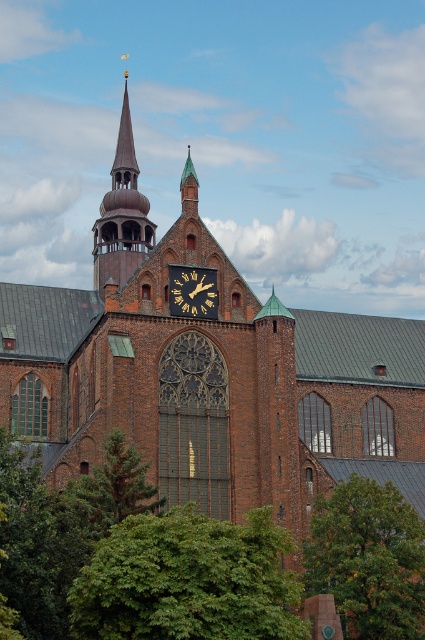
Does green leafy tree at lower left have a greater height compared to green needle-like tree at center-left?

Yes, green leafy tree at lower left is taller than green needle-like tree at center-left.

Is point (119, 625) positioned after point (116, 454)?

No, it is not.

Find the location of `green leafy tree at lower left`. green leafy tree at lower left is located at coordinates (189, 580).

Is brown wooden bell tower at upper center bigger than green needle-like tree at center-left?

Yes.

Is brown wooden bell tower at upper center thinner than green needle-like tree at center-left?

In fact, brown wooden bell tower at upper center might be wider than green needle-like tree at center-left.

I want to click on brown wooden bell tower at upper center, so click(x=121, y=214).

Can you confirm if green leafy tree at lower right is bigger than green needle-like tree at center-left?

Yes.

Can you confirm if green leafy tree at lower right is positioned above green needle-like tree at center-left?

Actually, green leafy tree at lower right is below green needle-like tree at center-left.

You are a GUI agent. You are given a task and a screenshot of the screen. Output one action in this format:
    pyautogui.click(x=<x>, y=<y>)
    Task: Click on the green leafy tree at lower right
    
    Given the screenshot: What is the action you would take?
    (x=368, y=560)